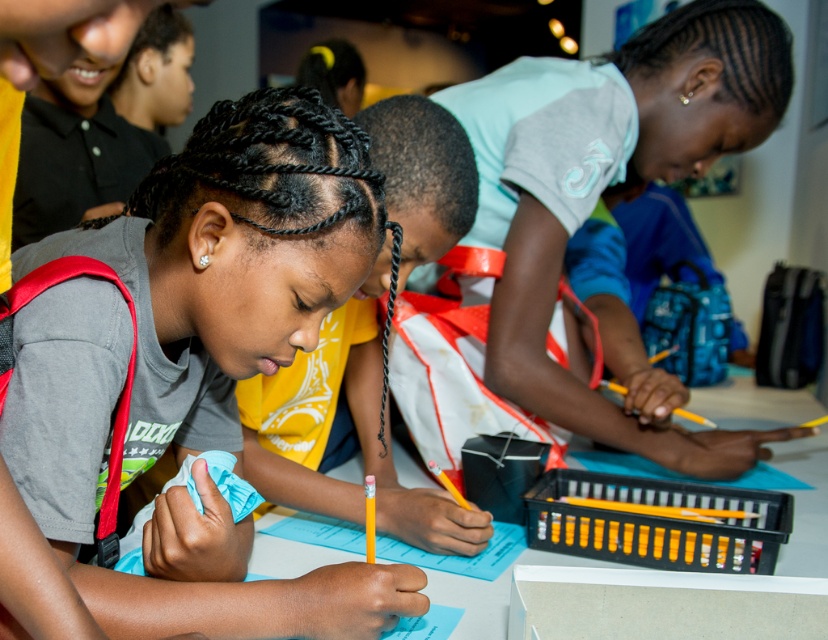
You are a photographer standing in front of the classroom scene. You want to take a photo that includes both the matte gray shirt at center and the light blue jersey at center. Which one will appear larger in your photo?

The matte gray shirt at center will appear larger in the photo because it is closer to the viewer than the light blue jersey at center.

You are a teacher observing the classroom scene. You notice the light blue jersey at center and the white plastic table at center. Which object is taller in this image?

The light blue jersey at center is taller than the white plastic table at center.

Based on the photo, you are a teacher organizing a classroom activity. You need to place a new poster on the wall behind the light blue jersey at center and the white plastic table at center. Which object should you place the poster closer to if you want the poster to be as far away as possible from the larger object?

The white plastic table at center is larger than the light blue jersey at center. To place the poster as far away as possible from the larger object, you should position it closer to the light blue jersey at center.